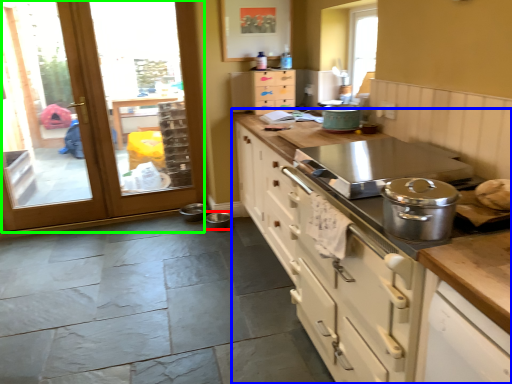
Question: Which is nearer to the appliance (highlighted by a red box)? cabinetry (highlighted by a blue box) or door (highlighted by a green box).

Choices:
 (A) cabinetry
 (B) door

Answer: (B)